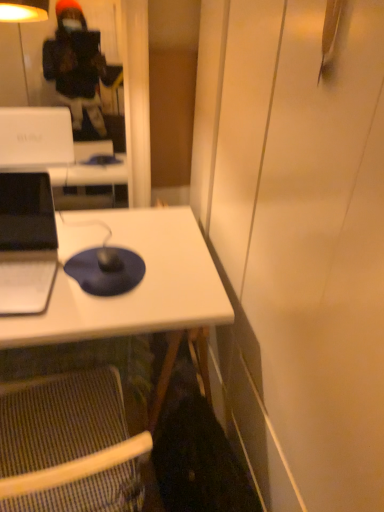
Question: Is striped fabric folding chair at lower left at the left side of matte black laptop at left?

Choices:
 (A) yes
 (B) no

Answer: (B)

Question: Does striped fabric folding chair at lower left have a smaller size compared to matte black laptop at left?

Choices:
 (A) yes
 (B) no

Answer: (B)

Question: Is striped fabric folding chair at lower left positioned in front of matte black laptop at left?

Choices:
 (A) no
 (B) yes

Answer: (B)

Question: Is striped fabric folding chair at lower left oriented away from matte black laptop at left?

Choices:
 (A) yes
 (B) no

Answer: (B)

Question: Could you tell me if striped fabric folding chair at lower left is facing matte black laptop at left?

Choices:
 (A) no
 (B) yes

Answer: (A)

Question: Looking at their shapes, would you say white matte desk at center is wider or thinner than matte black laptop at left?

Choices:
 (A) thin
 (B) wide

Answer: (B)

Question: Considering their positions, is white matte desk at center located in front of or behind matte black laptop at left?

Choices:
 (A) front
 (B) behind

Answer: (B)

Question: Considering the positions of point (211, 305) and point (18, 221), is point (211, 305) closer or farther from the camera than point (18, 221)?

Choices:
 (A) farther
 (B) closer

Answer: (B)

Question: From a real-world perspective, relative to matte black laptop at left, is white matte desk at center vertically above or below?

Choices:
 (A) above
 (B) below

Answer: (B)

Question: Is matte black laptop at left in front of or behind blue matte mousepad at center in the image?

Choices:
 (A) behind
 (B) front

Answer: (B)

Question: Would you say matte black laptop at left is to the left or to the right of blue matte mousepad at center in the picture?

Choices:
 (A) right
 (B) left

Answer: (B)

Question: Is point (3, 204) closer or farther from the camera than point (94, 254)?

Choices:
 (A) farther
 (B) closer

Answer: (B)

Question: In terms of width, does matte black laptop at left look wider or thinner when compared to blue matte mousepad at center?

Choices:
 (A) thin
 (B) wide

Answer: (B)

Question: In the image, is white matte desk at center on the left side or the right side of striped fabric folding chair at lower left?

Choices:
 (A) right
 (B) left

Answer: (B)

Question: From a real-world perspective, is white matte desk at center positioned above or below striped fabric folding chair at lower left?

Choices:
 (A) above
 (B) below

Answer: (B)